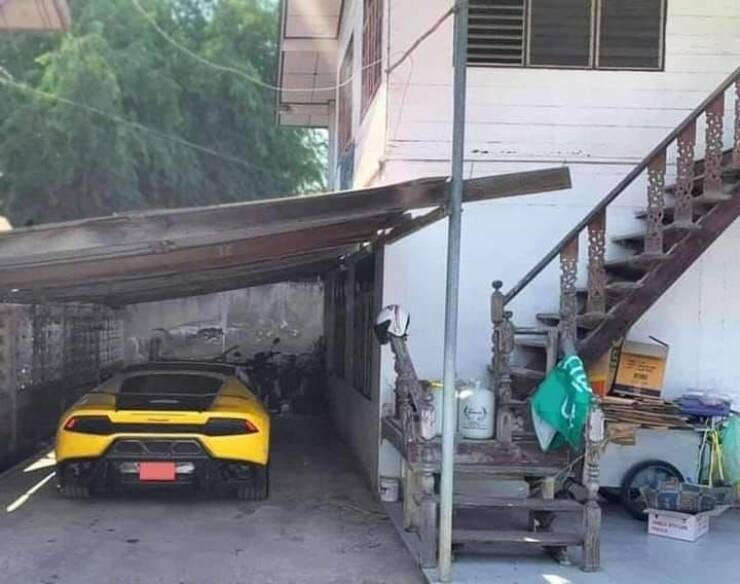
Where is `window with blinds`? window with blinds is located at coordinates (494, 32), (556, 30), (633, 34).